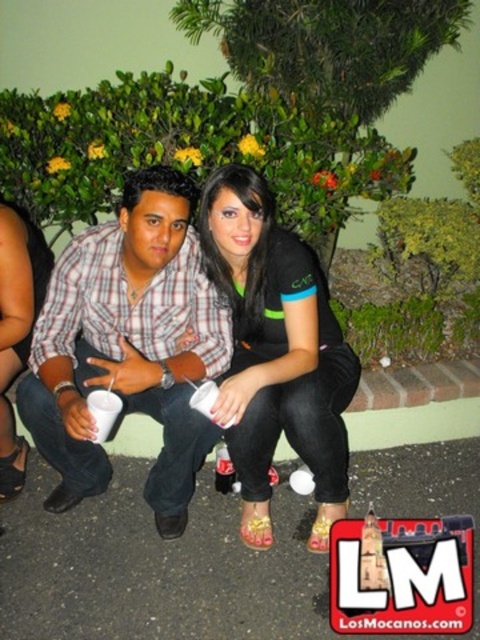
Looking at this image, does plaid shirt at center appear on the left side of black matte shirt at center?

Indeed, plaid shirt at center is positioned on the left side of black matte shirt at center.

Is plaid shirt at center wider than black matte shirt at center?

Yes, plaid shirt at center is wider than black matte shirt at center.

Describe the element at coordinates (129, 346) in the screenshot. I see `plaid shirt at center` at that location.

You are a GUI agent. You are given a task and a screenshot of the screen. Output one action in this format:
    pyautogui.click(x=<x>, y=<y>)
    Task: Click on the plaid shirt at center
    The image size is (480, 640).
    Given the screenshot: What is the action you would take?
    pyautogui.click(x=129, y=346)